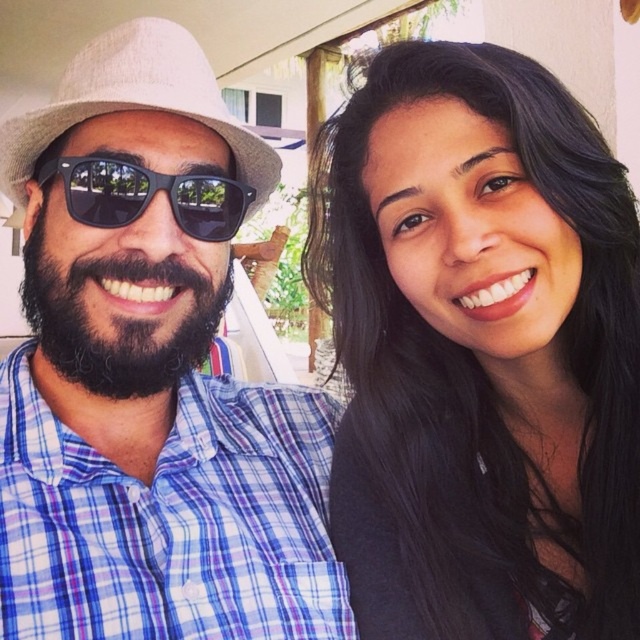
You are standing at the point closest to the camera in the image. Which point are you at, point (x=60, y=109) or point (x=52, y=310)?

You are at point (x=60, y=109) because it is in front of point (x=52, y=310).

You are a photographer trying to adjust the focus of your camera. You need to decide which object to focus on first between the plaid cotton shirt at left and the dark brown thick beard at center. Which one should you focus on if you want to prioritize the larger object?

The plaid cotton shirt at left is bigger than the dark brown thick beard at center, so you should focus on the plaid cotton shirt at left first to prioritize the larger object.

You are a photographer trying to capture a closeup shot of the dark brown thick beard at center while ensuring the beige straw fedora at left is still visible in the frame. Based on their positions, can you confirm if the fedora is to the left of the beard?

The beige straw fedora at left is positioned on the left side of dark brown thick beard at center, so yes, the fedora is to the left of the beard.